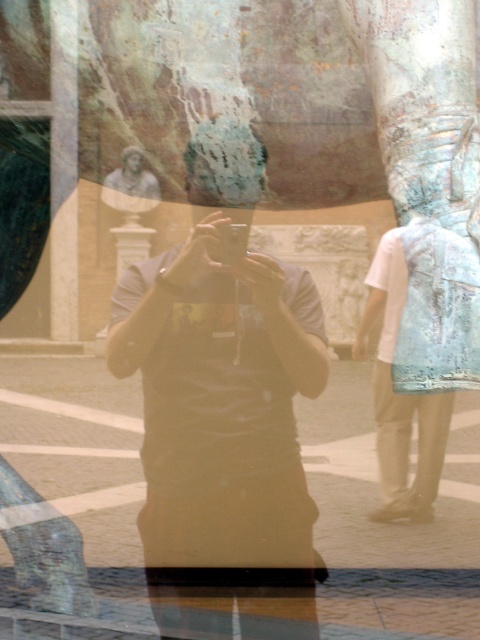
Is matte black t-shirt at center smaller than light blue fabric shirt at right?

Incorrect, matte black t-shirt at center is not smaller in size than light blue fabric shirt at right.

Does point (115, 324) come behind point (359, 346)?

No.

Find the location of a particular element. matte black t-shirt at center is located at coordinates (222, 385).